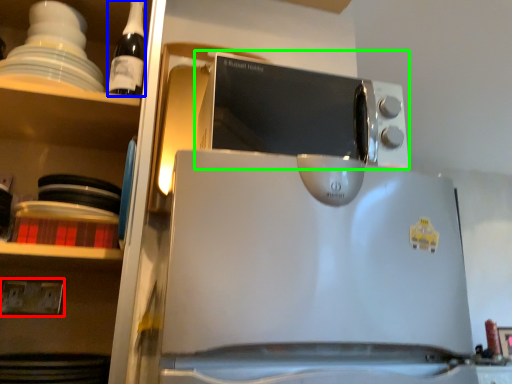
Question: Which is nearer to the electric outlet (highlighted by a red box)? bottle (highlighted by a blue box) or microwave oven (highlighted by a green box).

Choices:
 (A) bottle
 (B) microwave oven

Answer: (A)